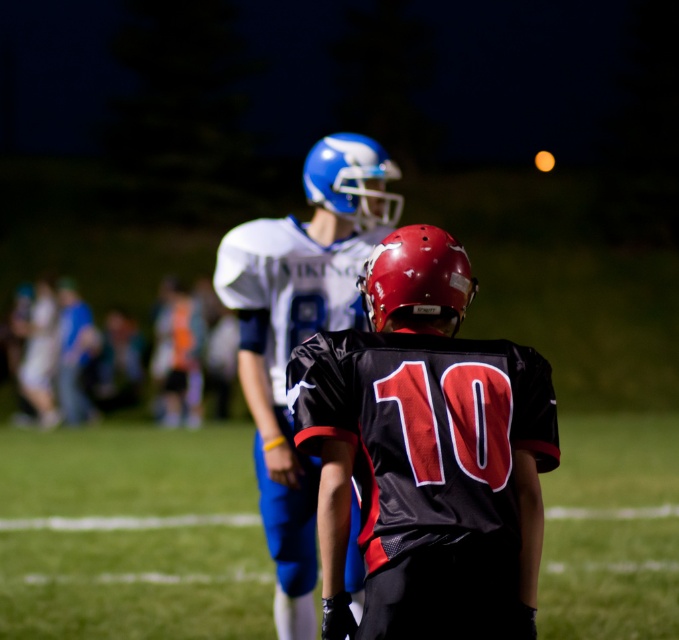
Consider the image. You are a photographer trying to capture a wide shot of the nighttime football game. You want to ensure both the green grass football field at center and the white matte jersey at center are visible in your frame. Given the spatial relationship between them, can you fit both into your shot without zooming in?

The green grass football field at center is wider than the white matte jersey at center, so yes, both can be captured in the frame as the field provides ample space for the jersey to be included without needing to zoom in.

You are a coach standing at the edge of the green grass football field at center. You need to throw a ball to both players. Which player is farther from you?

The player in the white jersey with blue accents is farther from the coach because they are 8.83 meters apart from each other, so the one behind is farther away.

You are a photographer standing at the origin point of the image coordinate system. You need to capture a closeup shot of the black mesh jersey at center. What are the coordinates where you should aim your camera?

The coordinates to aim the camera are at point (426, 452) to capture the black mesh jersey at center.